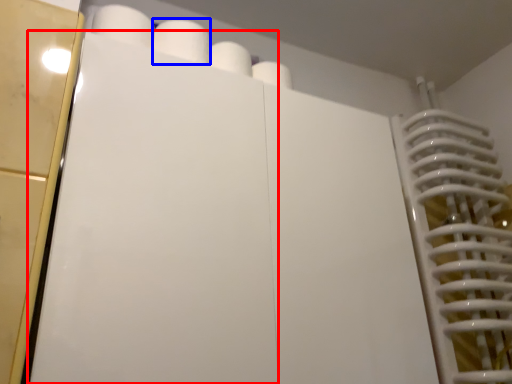
Question: Which object appears closest to the camera in this image, door (highlighted by a red box) or paper towel (highlighted by a blue box)?

Choices:
 (A) door
 (B) paper towel

Answer: (A)